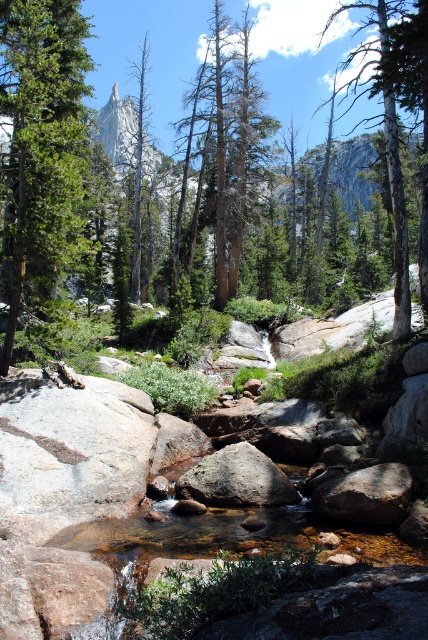
Question: Which point is farther to the camera?

Choices:
 (A) smooth gray rock at center
 (B) green matte tree at center

Answer: (B)

Question: Can you confirm if green mossy rock at center is positioned to the left of dead wood at center?

Choices:
 (A) no
 (B) yes

Answer: (A)

Question: Does green mossy rock at center have a greater width compared to dead wood at center?

Choices:
 (A) no
 (B) yes

Answer: (A)

Question: Among these points, which one is nearest to the camera?

Choices:
 (A) (398, 326)
 (B) (45, 38)
 (C) (225, 84)

Answer: (A)

Question: Which of the following is the closest to the observer?

Choices:
 (A) green matte tree at left
 (B) green matte tree at center
 (C) dead wood at center

Answer: (A)

Question: Can you confirm if green matte tree at left is positioned above green mossy rock at center?

Choices:
 (A) yes
 (B) no

Answer: (A)